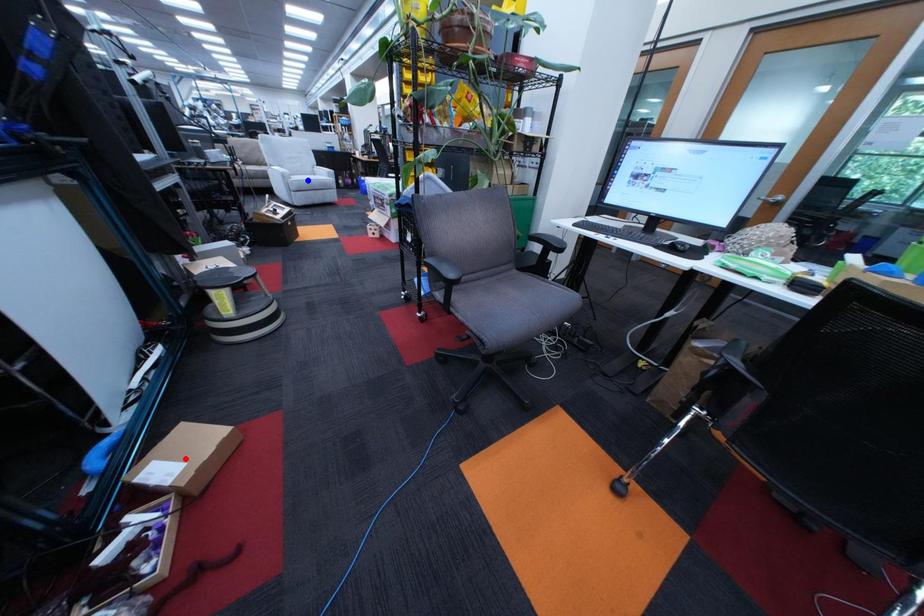
Question: In the image, two points are highlighted. Which point is nearer to the camera? Reply with the corresponding letter.

Choices:
 (A) blue point
 (B) red point

Answer: (B)